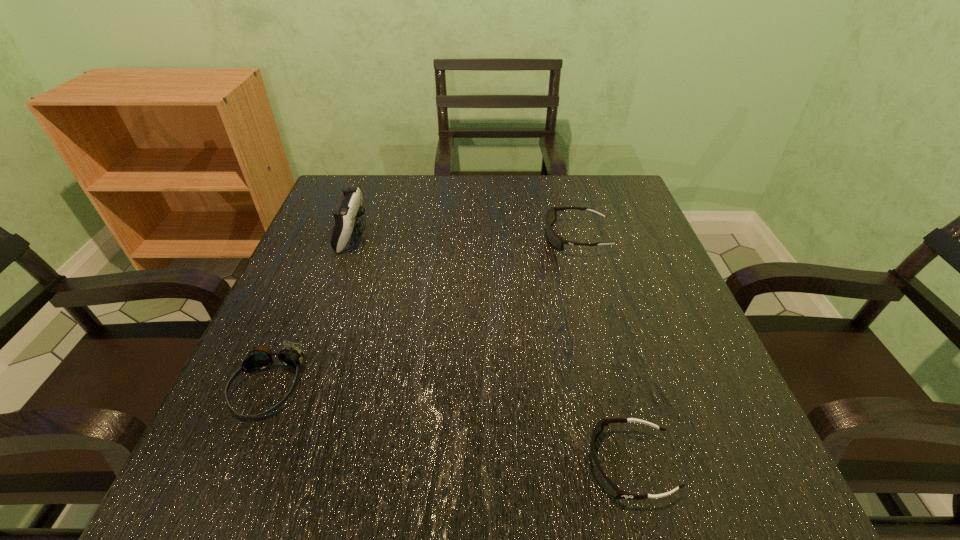
Where is `free spot between the farthest goggles and the shortest object`? The image size is (960, 540). free spot between the farthest goggles and the shortest object is located at coordinates (603, 351).

At what (x,y) coordinates should I click in order to perform the action: click on empty space that is in between the second farthest goggles and the control. Please return your answer as a coordinate pair (x, y). The width and height of the screenshot is (960, 540). Looking at the image, I should click on (310, 310).

At what (x,y) coordinates should I click in order to perform the action: click on empty space between the shortest goggles and the third farthest object. Please return your answer as a coordinate pair (x, y). Looking at the image, I should click on (448, 425).

Where is `empty location between the nearest goggles and the control`? Image resolution: width=960 pixels, height=540 pixels. empty location between the nearest goggles and the control is located at coordinates (491, 349).

This screenshot has height=540, width=960. I want to click on free space between the shortest goggles and the control, so click(x=491, y=349).

I want to click on blank region between the third farthest object and the nearest object, so click(x=448, y=425).

Locate an element on the screen. The image size is (960, 540). vacant region between the second farthest goggles and the farthest goggles is located at coordinates (422, 312).

In order to click on empty space between the control and the shortest object in this screenshot , I will do (x=491, y=349).

Where is `unoccupied position between the second farthest goggles and the control`? The width and height of the screenshot is (960, 540). unoccupied position between the second farthest goggles and the control is located at coordinates (310, 310).

You are a GUI agent. You are given a task and a screenshot of the screen. Output one action in this format:
    pyautogui.click(x=<x>, y=<y>)
    Task: Click on the unoccupied area between the nearest object and the farthest goggles
    Image resolution: width=960 pixels, height=540 pixels.
    Given the screenshot: What is the action you would take?
    pyautogui.click(x=603, y=351)